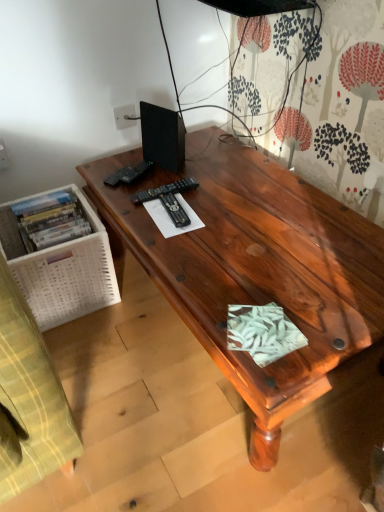
Question: From a real-world perspective, is black matte speaker at upper left located higher than satin wood desk at center?

Choices:
 (A) yes
 (B) no

Answer: (A)

Question: Is satin wood desk at center completely or partially inside black matte speaker at upper left?

Choices:
 (A) no
 (B) yes

Answer: (A)

Question: Does black matte speaker at upper left appear on the right side of satin wood desk at center?

Choices:
 (A) yes
 (B) no

Answer: (B)

Question: Considering the relative sizes of black matte speaker at upper left and satin wood desk at center in the image provided, is black matte speaker at upper left smaller than satin wood desk at center?

Choices:
 (A) yes
 (B) no

Answer: (A)

Question: From a real-world perspective, is black matte speaker at upper left positioned under satin wood desk at center based on gravity?

Choices:
 (A) yes
 (B) no

Answer: (B)

Question: Does black matte speaker at upper left have a greater height compared to satin wood desk at center?

Choices:
 (A) no
 (B) yes

Answer: (A)

Question: Is black plastic remote control at upper left, the first remote control in the back-to-front sequence, oriented away from black matte speaker at upper left?

Choices:
 (A) yes
 (B) no

Answer: (A)

Question: From the image's perspective, does black plastic remote control at upper left, the first remote control in the back-to-front sequence, appear higher than black matte speaker at upper left?

Choices:
 (A) yes
 (B) no

Answer: (B)

Question: Is black plastic remote control at upper left, marked as the third remote control in a front-to-back arrangement, beside black matte speaker at upper left?

Choices:
 (A) yes
 (B) no

Answer: (B)

Question: Is black plastic remote control at upper left, marked as the third remote control in a front-to-back arrangement, smaller than black matte speaker at upper left?

Choices:
 (A) yes
 (B) no

Answer: (A)

Question: Considering the relative sizes of black plastic remote control at upper left, the first remote control in the back-to-front sequence, and black matte speaker at upper left in the image provided, is black plastic remote control at upper left, the first remote control in the back-to-front sequence, taller than black matte speaker at upper left?

Choices:
 (A) yes
 (B) no

Answer: (B)

Question: Is black plastic remote control at upper left, the first remote control in the back-to-front sequence, positioned far away from black matte speaker at upper left?

Choices:
 (A) yes
 (B) no

Answer: (B)

Question: Is black plastic remote control at center, the 3th remote control positioned from the back, smaller than black plastic remote control at center, acting as the second remote control starting from the front?

Choices:
 (A) no
 (B) yes

Answer: (B)